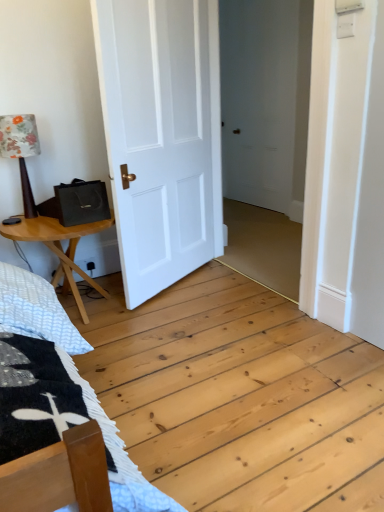
Question: Is wooden table at left outside of floral fabric lampshade at left?

Choices:
 (A) no
 (B) yes

Answer: (B)

Question: Is wooden table at left facing away from floral fabric lampshade at left?

Choices:
 (A) no
 (B) yes

Answer: (A)

Question: Does wooden table at left have a larger size compared to floral fabric lampshade at left?

Choices:
 (A) no
 (B) yes

Answer: (B)

Question: Is wooden table at left smaller than floral fabric lampshade at left?

Choices:
 (A) no
 (B) yes

Answer: (A)

Question: From a real-world perspective, is wooden table at left physically above floral fabric lampshade at left?

Choices:
 (A) yes
 (B) no

Answer: (B)

Question: Are wooden table at left and floral fabric lampshade at left located far from each other?

Choices:
 (A) no
 (B) yes

Answer: (A)

Question: Does white matte door at center appear on the right side of floral fabric lampshade at left?

Choices:
 (A) yes
 (B) no

Answer: (A)

Question: Is the depth of white matte door at center greater than that of floral fabric lampshade at left?

Choices:
 (A) no
 (B) yes

Answer: (A)

Question: From a real-world perspective, is white matte door at center on top of floral fabric lampshade at left?

Choices:
 (A) yes
 (B) no

Answer: (A)

Question: Is white matte door at center facing towards floral fabric lampshade at left?

Choices:
 (A) no
 (B) yes

Answer: (A)

Question: From the image's perspective, is white matte door at center on floral fabric lampshade at left?

Choices:
 (A) no
 (B) yes

Answer: (B)

Question: Is white matte door at center not within floral fabric lampshade at left?

Choices:
 (A) yes
 (B) no

Answer: (A)

Question: From the image's perspective, is wooden table at left beneath white matte door at center?

Choices:
 (A) yes
 (B) no

Answer: (A)